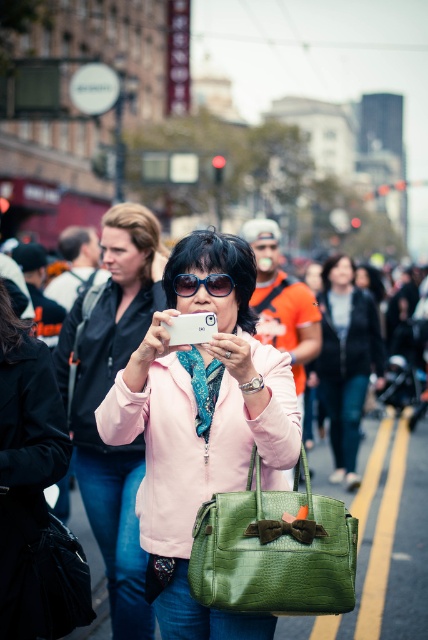
The height and width of the screenshot is (640, 428). What do you see at coordinates (202, 426) in the screenshot?
I see `matte white phone at center` at bounding box center [202, 426].

Who is taller, matte white phone at center or matte green handbag at center?

With more height is matte white phone at center.

At what (x,y) coordinates should I click in order to perform the action: click on matte white phone at center. Please return your answer as a coordinate pair (x, y). The width and height of the screenshot is (428, 640). Looking at the image, I should click on (202, 426).

Does matte white phone at center come in front of green crocodile-patterned handbag at center?

No, matte white phone at center is behind green crocodile-patterned handbag at center.

Measure the distance between matte white phone at center and camera.

They are 4.33 meters apart.

This screenshot has width=428, height=640. Identify the location of matte white phone at center. (202, 426).

Is green crocodile-patterned handbag at center closer to the viewer compared to matte green leather bag at center?

Yes.

Is green crocodile-patterned handbag at center bigger than matte green leather bag at center?

No.

The image size is (428, 640). What do you see at coordinates (273, 548) in the screenshot?
I see `green crocodile-patterned handbag at center` at bounding box center [273, 548].

Find the location of a particular element. The height and width of the screenshot is (640, 428). green crocodile-patterned handbag at center is located at coordinates (273, 548).